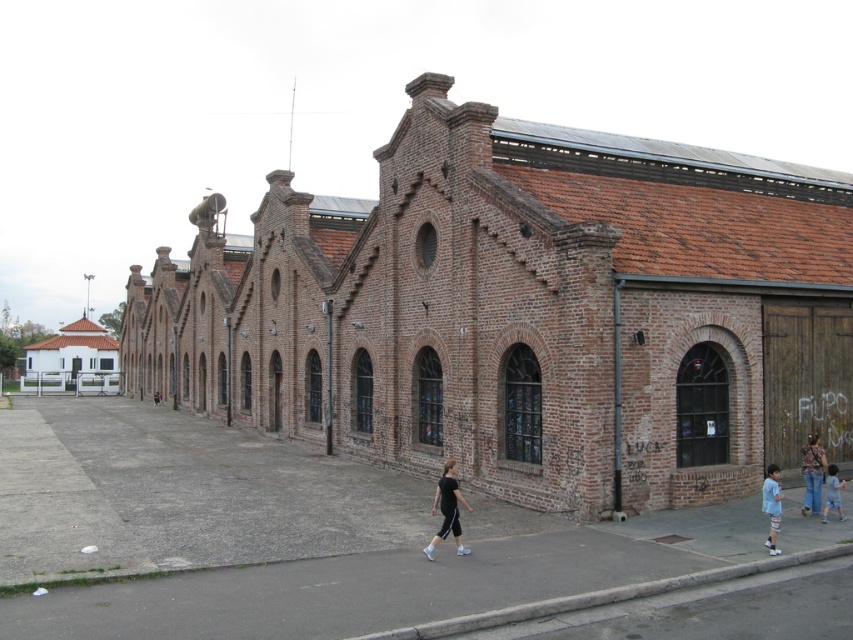
You are standing in front of the long brick building and notice a brown brick alley at center and a patterned fabric shirt at lower right. Which object is wider?

The brown brick alley at center is wider than the patterned fabric shirt at lower right.

You are standing in front of the long brick building with arched windows. You notice an object labeled as black matte pants at center. Can you determine its exact location in the scene using coordinates?

The black matte pants at center is located at coordinates point (447, 509).

You are a fashion designer observing the image. You need to determine which item of clothing is shorter between the black matte pants at center and the light blue denim shorts at lower right. Based on the scene, which one is shorter?

The black matte pants at center is not as tall as light blue denim shorts at lower right, so the black matte pants at center is shorter.